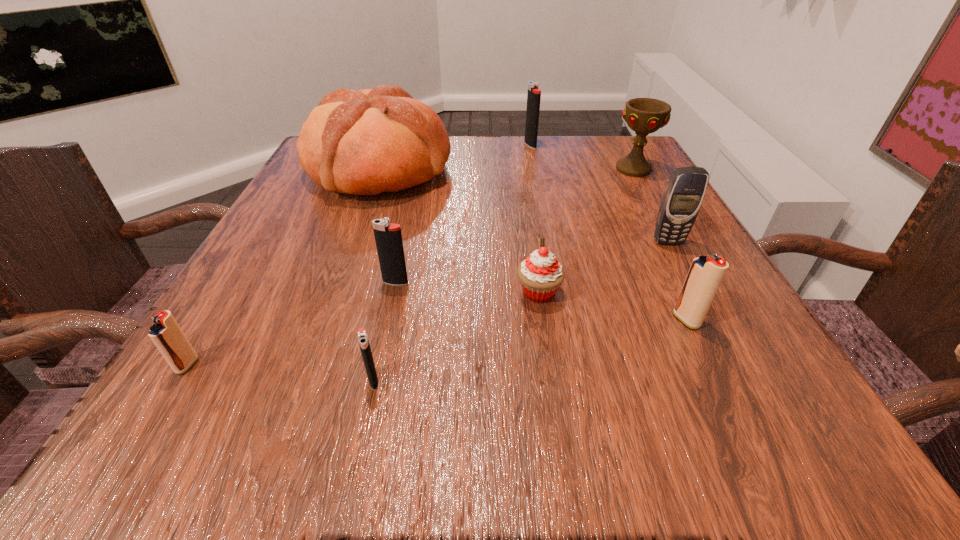
I want to click on igniter that is the second nearest to the cellular telephone, so pos(534,93).

The width and height of the screenshot is (960, 540). In order to click on black igniter that can be found as the second closest to the second igniter from right to left in this screenshot , I will do `click(362, 337)`.

The width and height of the screenshot is (960, 540). I want to click on black igniter identified as the second closest to the biggest black igniter, so click(362, 337).

Locate an element on the screen. The height and width of the screenshot is (540, 960). free location that satisfies the following two spatial constraints: 1. on the back side of the nearest black igniter; 2. on the left side of the farther red igniter is located at coordinates click(x=387, y=320).

Locate an element on the screen. This screenshot has height=540, width=960. vacant area that satisfies the following two spatial constraints: 1. on the back side of the rightmost igniter; 2. on the right side of the nearest black igniter is located at coordinates (387, 320).